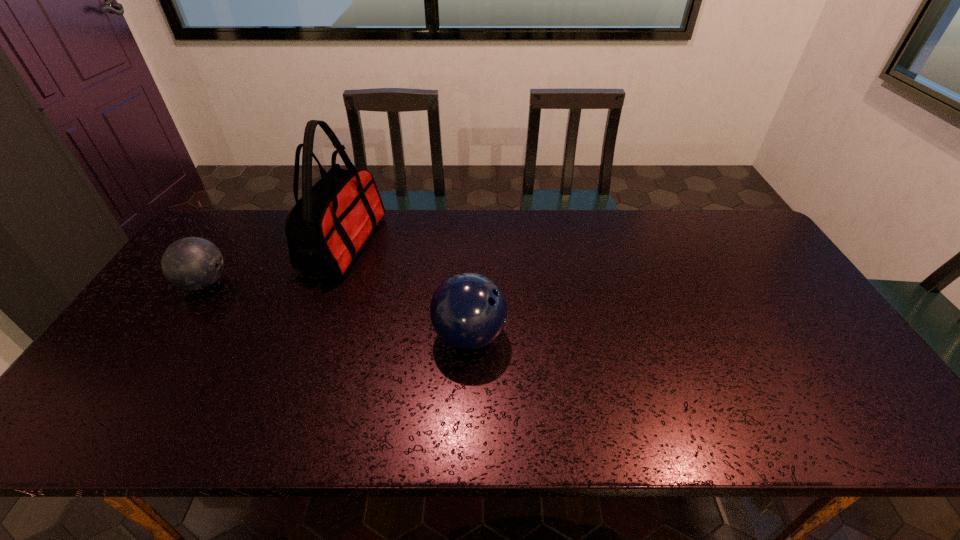
Locate an element on the screen. object present at the left edge is located at coordinates (192, 263).

You are a GUI agent. You are given a task and a screenshot of the screen. Output one action in this format:
    pyautogui.click(x=<x>, y=<y>)
    Task: Click on the blank space at the far edge
    Image resolution: width=960 pixels, height=540 pixels.
    Given the screenshot: What is the action you would take?
    pyautogui.click(x=655, y=241)

This screenshot has width=960, height=540. Find the location of `vacant region at the near edge`. vacant region at the near edge is located at coordinates (468, 410).

This screenshot has width=960, height=540. Identify the location of free space at the left edge of the desktop. (191, 335).

Image resolution: width=960 pixels, height=540 pixels. Find the location of `free spot at the right edge of the desktop`. free spot at the right edge of the desktop is located at coordinates (743, 278).

The width and height of the screenshot is (960, 540). Find the location of `vacant space at the far left corner`. vacant space at the far left corner is located at coordinates (210, 229).

The height and width of the screenshot is (540, 960). I want to click on vacant space at the far right corner of the desktop, so click(729, 234).

In order to click on free space between the shortest object and the tallest object in this screenshot , I will do `click(275, 263)`.

Identify the location of vacant area between the shortest object and the right bowling ball. (337, 309).

Where is `empty space between the nearer bowling ball and the second object from left to right`? empty space between the nearer bowling ball and the second object from left to right is located at coordinates (406, 289).